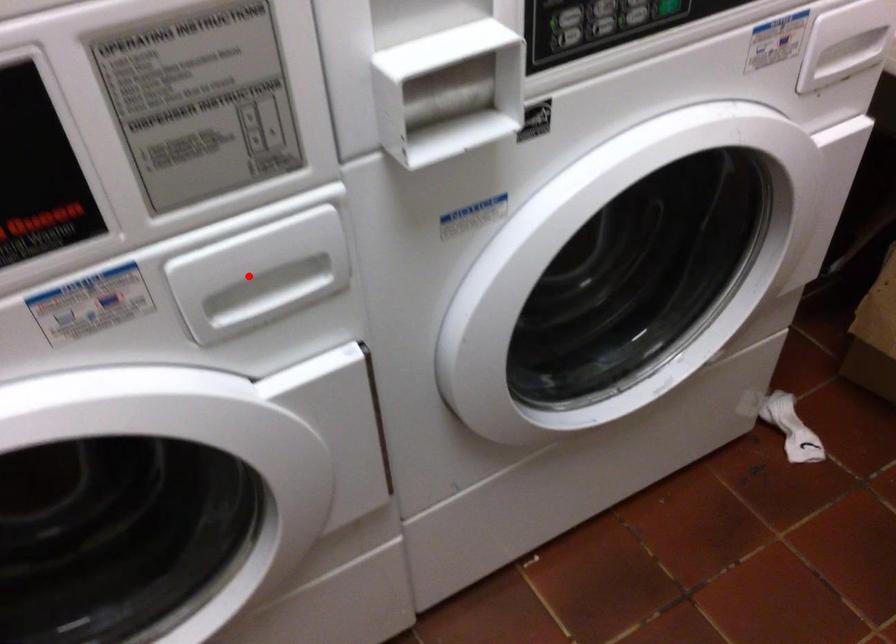
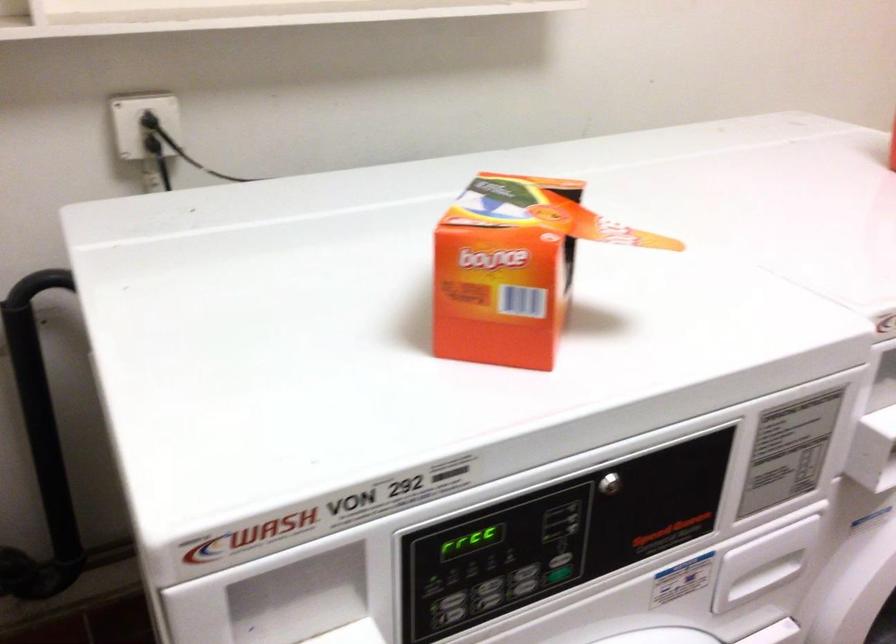
The point at the highlighted location is marked in the first image. Where is the corresponding point in the second image?

(762, 576)